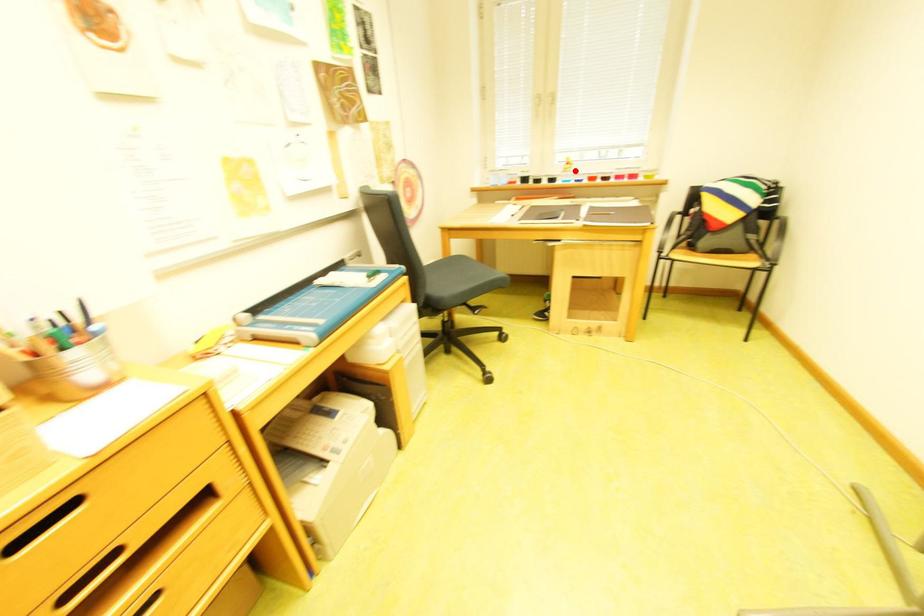
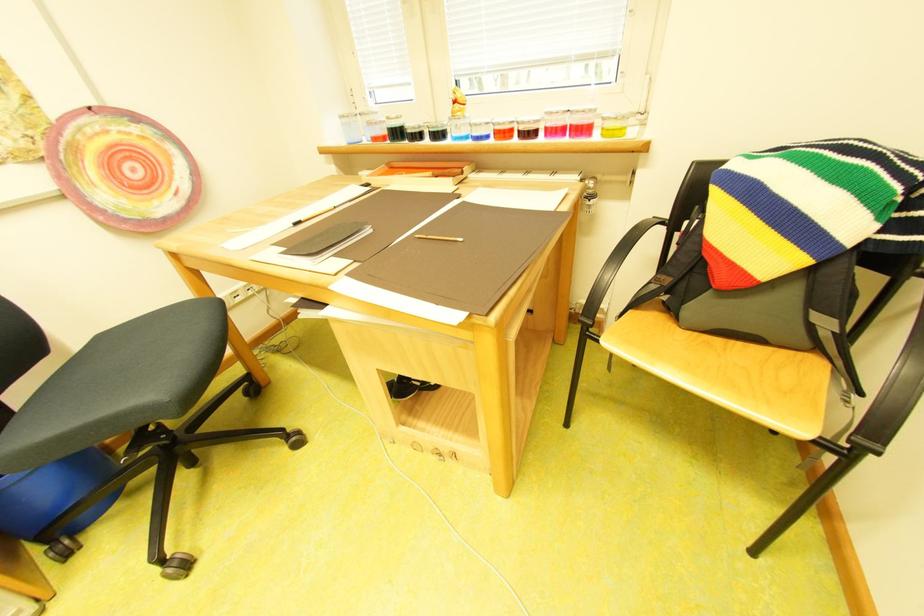
Locate, in the second image, the point that corresponds to the highlighted location in the first image.

(465, 115)